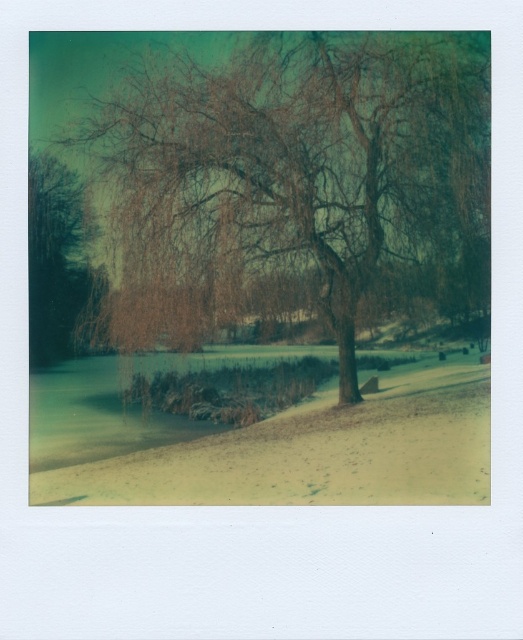
Does brown textured tree at center appear on the right side of brown matte tree at left?

Correct, you'll find brown textured tree at center to the right of brown matte tree at left.

Based on the photo, which is more to the right, brown textured tree at center or brown matte tree at left?

From the viewer's perspective, brown textured tree at center appears more on the right side.

What do you see at coordinates (290, 173) in the screenshot?
I see `brown textured tree at center` at bounding box center [290, 173].

Find the location of a particular element. The image size is (523, 640). brown textured tree at center is located at coordinates (290, 173).